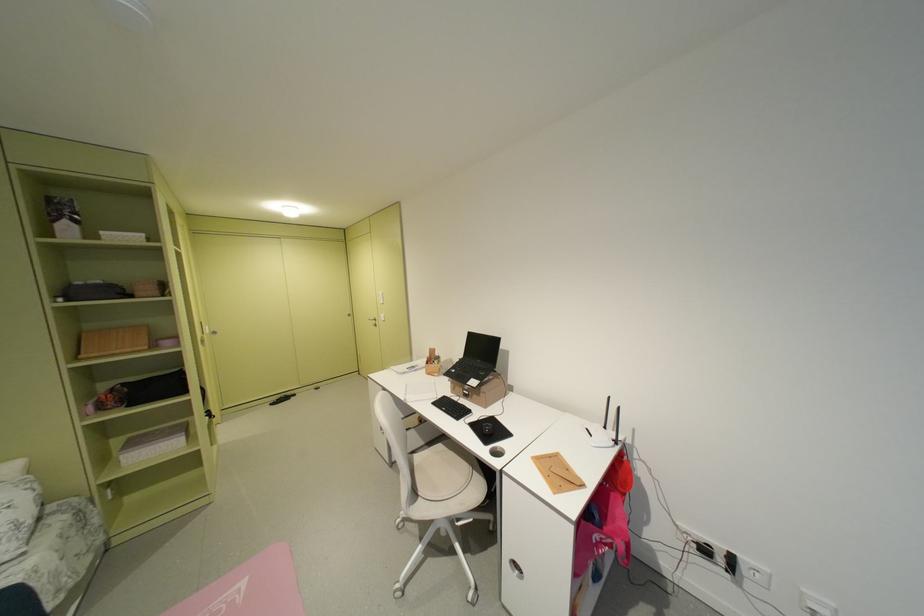
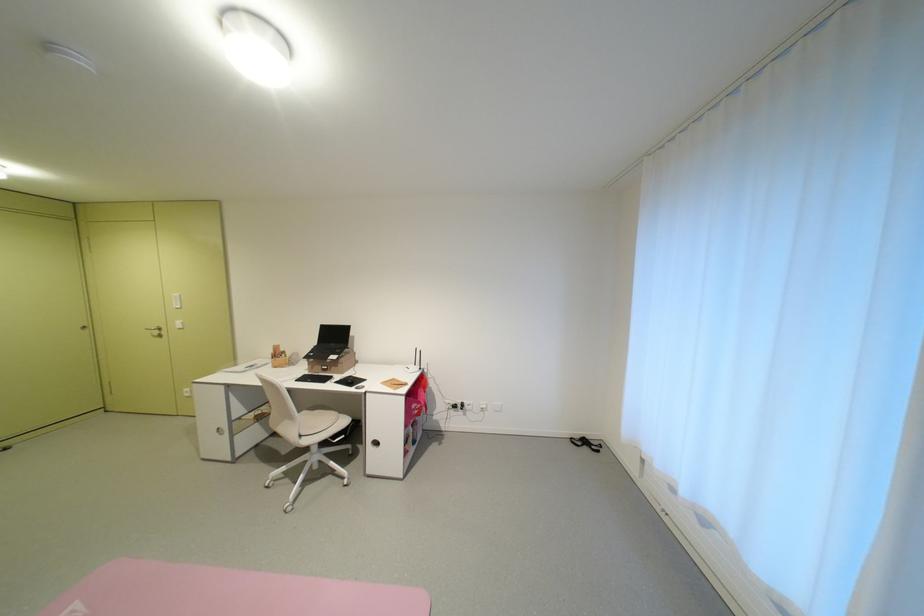
Where in the second image is the point corresponding to [470,358] from the first image?

(324, 345)